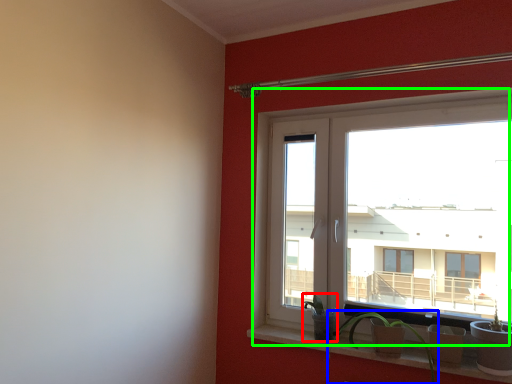
Question: Based on their relative distances, which object is nearer to plant (highlighted by a red box)? Choose from houseplant (highlighted by a blue box) and window (highlighted by a green box).

Choices:
 (A) houseplant
 (B) window

Answer: (A)